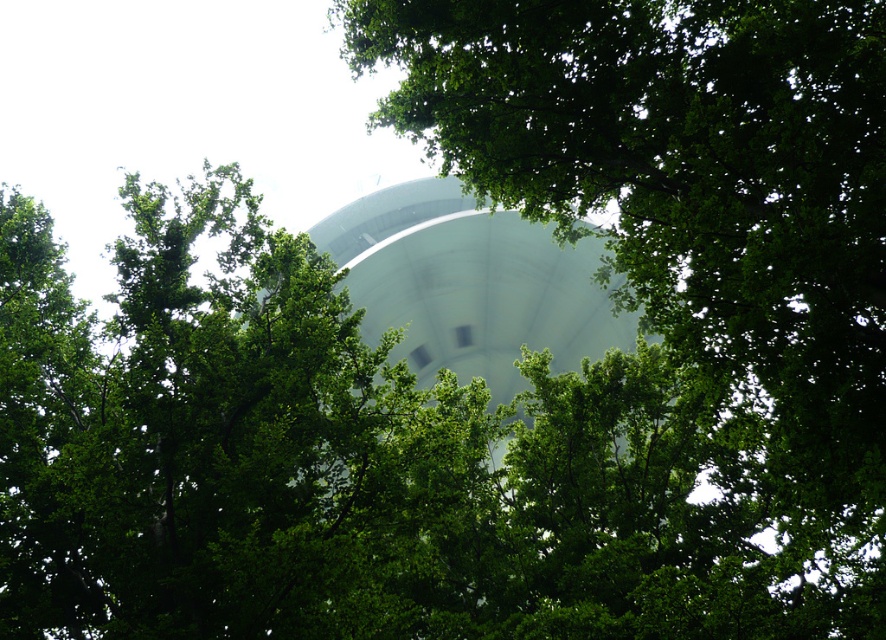
Question: Is green leafy tree at center to the left of white smooth water tower at center from the viewer's perspective?

Choices:
 (A) yes
 (B) no

Answer: (B)

Question: Does green leafy tree at center appear on the right side of white smooth water tower at center?

Choices:
 (A) no
 (B) yes

Answer: (B)

Question: Does green leafy tree at center appear over white smooth water tower at center?

Choices:
 (A) yes
 (B) no

Answer: (B)

Question: Among these points, which one is nearest to the camera?

Choices:
 (A) (377, 196)
 (B) (628, 362)

Answer: (B)